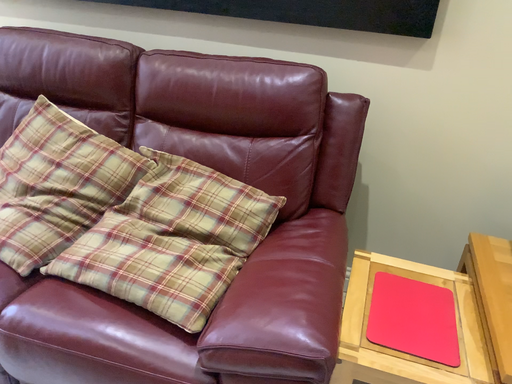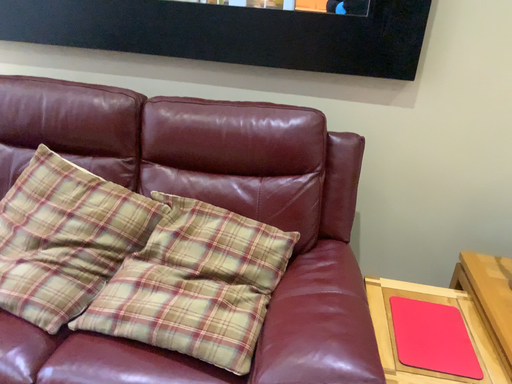
Question: Which way did the camera rotate in the video?

Choices:
 (A) rotated right
 (B) rotated left

Answer: (A)